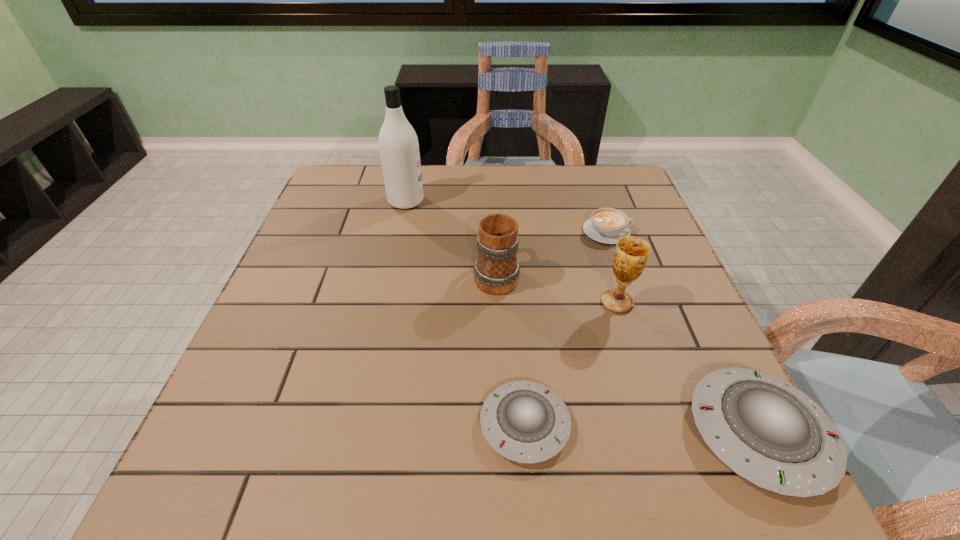
Where is `object that is at the near right corner`? The width and height of the screenshot is (960, 540). object that is at the near right corner is located at coordinates (768, 432).

In the image, there is a desktop. Where is `free space at the far edge`? This screenshot has width=960, height=540. free space at the far edge is located at coordinates (432, 173).

Where is `vacant space at the near edge of the desktop`? The width and height of the screenshot is (960, 540). vacant space at the near edge of the desktop is located at coordinates (373, 417).

The width and height of the screenshot is (960, 540). In the image, there is a desktop. Find the location of `free space at the left edge`. free space at the left edge is located at coordinates (337, 321).

At what (x,y) coordinates should I click in order to perform the action: click on blank space at the right edge. Please return your answer as a coordinate pair (x, y). Looking at the image, I should click on (682, 276).

You are a GUI agent. You are given a task and a screenshot of the screen. Output one action in this format:
    pyautogui.click(x=<x>, y=<y>)
    Task: Click on the vacant space at the far right corner
    
    Given the screenshot: What is the action you would take?
    pyautogui.click(x=616, y=202)

In the image, there is a desktop. What are the coordinates of `free space at the near right corner` in the screenshot? It's located at (662, 433).

Locate an element on the screen. Image resolution: width=960 pixels, height=540 pixels. vacant area that lies between the mug and the left saucer is located at coordinates (511, 349).

Locate an element on the screen. empty space that is in between the second farthest object and the mug is located at coordinates (552, 253).

Locate an element on the screen. Image resolution: width=960 pixels, height=540 pixels. free space between the shorter saucer and the farthest object is located at coordinates (466, 313).